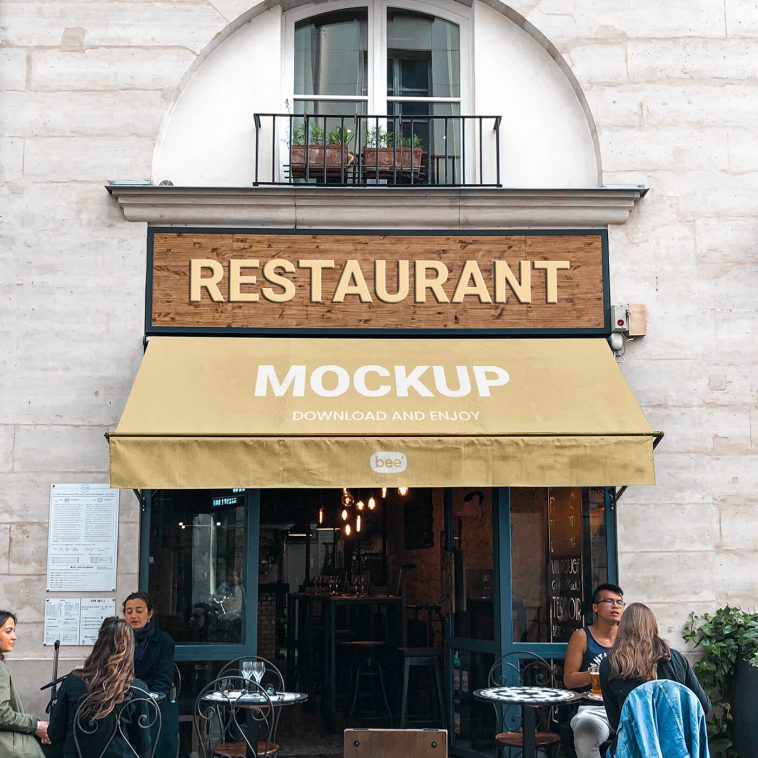
Identify the location of doors. Image resolution: width=758 pixels, height=758 pixels. (299, 590), (467, 602).